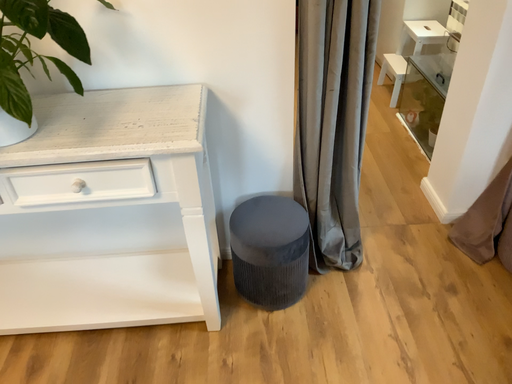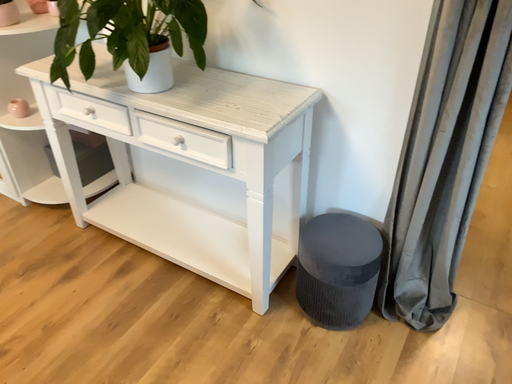
Question: Which way did the camera rotate in the video?

Choices:
 (A) rotated left
 (B) rotated right

Answer: (A)